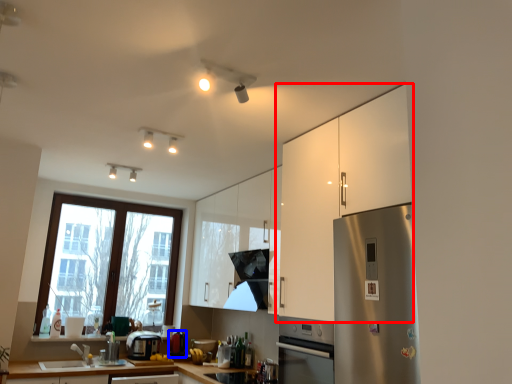
Question: Which of the following is the farthest to the observer, cabinetry (highlighted by a red box) or appliance (highlighted by a blue box)?

Choices:
 (A) cabinetry
 (B) appliance

Answer: (B)